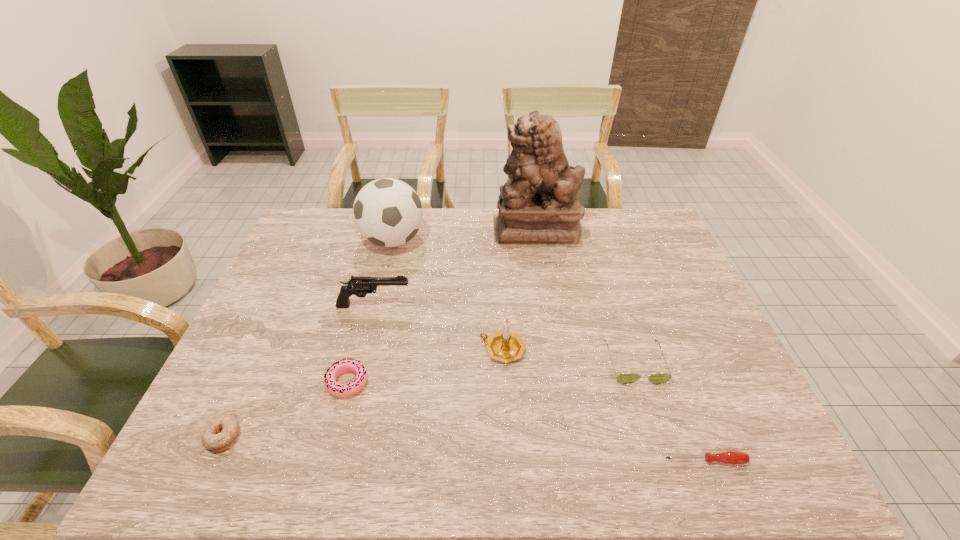
In the image, there is a desktop. Where is `vacant space at the left edge`? This screenshot has width=960, height=540. vacant space at the left edge is located at coordinates (245, 343).

In the image, there is a desktop. Where is `vacant region at the right edge`? vacant region at the right edge is located at coordinates (720, 393).

Identify the location of free space at the far left corner of the desktop. (334, 223).

Identify the location of free spot between the farther doughnut and the gun. (361, 344).

Find the location of a particular element. The image size is (960, 540). vacant space that is in between the sunglasses and the nearer doughnut is located at coordinates (429, 400).

Identify the location of vacant area between the right doughnut and the nearer doughnut. (285, 409).

The height and width of the screenshot is (540, 960). In order to click on empty space that is in between the second tallest object and the farther doughnut in this screenshot , I will do `click(371, 312)`.

Image resolution: width=960 pixels, height=540 pixels. In order to click on vacant area between the screwdriver and the sunglasses in this screenshot , I will do `click(670, 412)`.

This screenshot has height=540, width=960. Identify the location of empty location between the sixth nearest object and the tallest object. (455, 268).

Locate an element on the screen. Image resolution: width=960 pixels, height=540 pixels. free spot between the nearest object and the sunglasses is located at coordinates (670, 412).